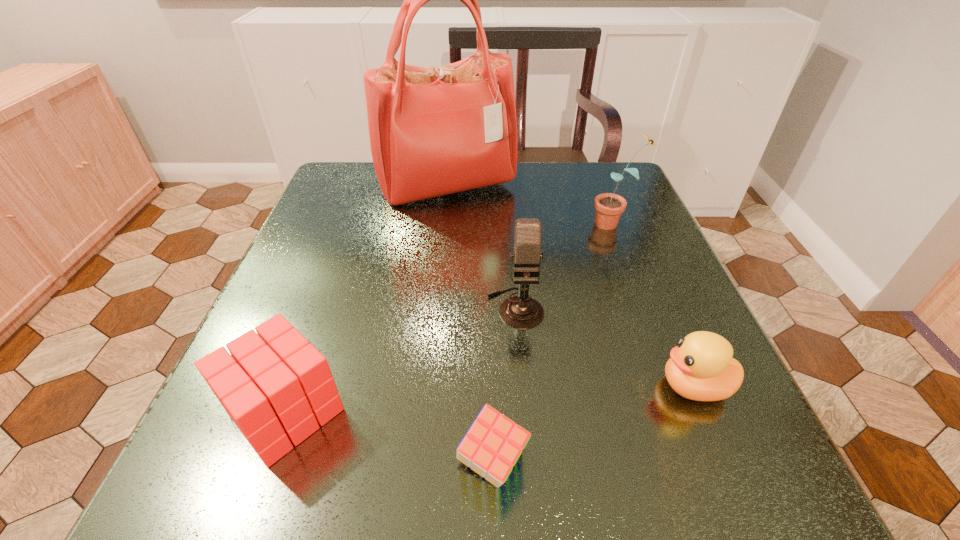
Where is `handbag`? handbag is located at coordinates (433, 131).

Identify the location of sunflower. This screenshot has height=540, width=960. (609, 206).

This screenshot has width=960, height=540. I want to click on the third farthest object, so click(522, 312).

At what (x,y) coordinates should I click in order to perform the action: click on the left cube. Please return your answer as a coordinate pair (x, y). Looking at the image, I should click on (275, 386).

Locate an element on the screen. duckling is located at coordinates (701, 368).

You are a GUI agent. You are given a task and a screenshot of the screen. Output one action in this format:
    pyautogui.click(x=<x>, y=<y>)
    Task: Click on the shorter cube
    
    Given the screenshot: What is the action you would take?
    pyautogui.click(x=493, y=444)

Locate an element on the screen. Image resolution: width=960 pixels, height=540 pixels. the shortest object is located at coordinates (493, 444).

Locate an element on the screen. The width and height of the screenshot is (960, 540). blank space located 0.400m on the front-facing side of the tallest object is located at coordinates (430, 362).

This screenshot has height=540, width=960. Find the location of `vacant area situated on the flower of the sunflower`. vacant area situated on the flower of the sunflower is located at coordinates (485, 223).

Image resolution: width=960 pixels, height=540 pixels. Identify the location of vacant region located 0.280m on the flower of the sunflower. (462, 223).